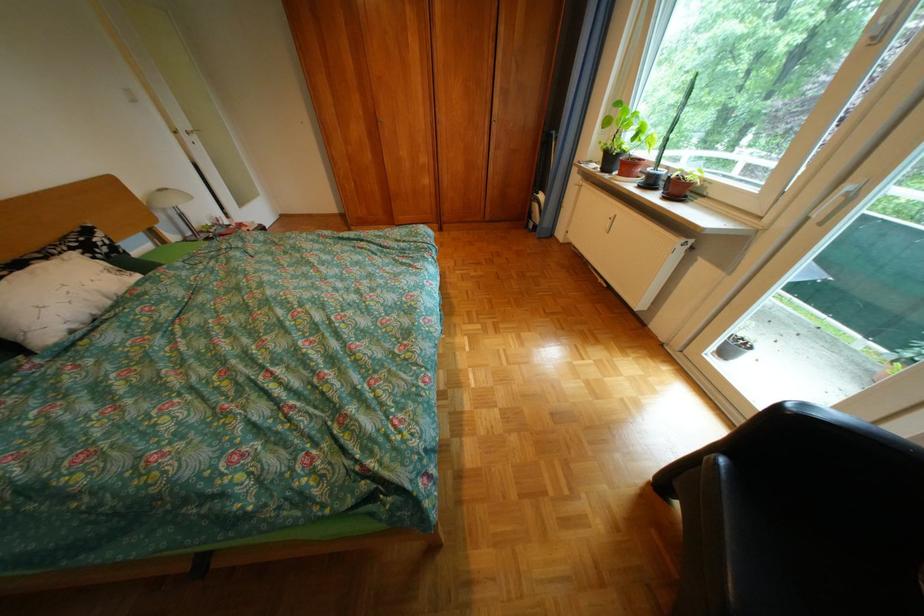
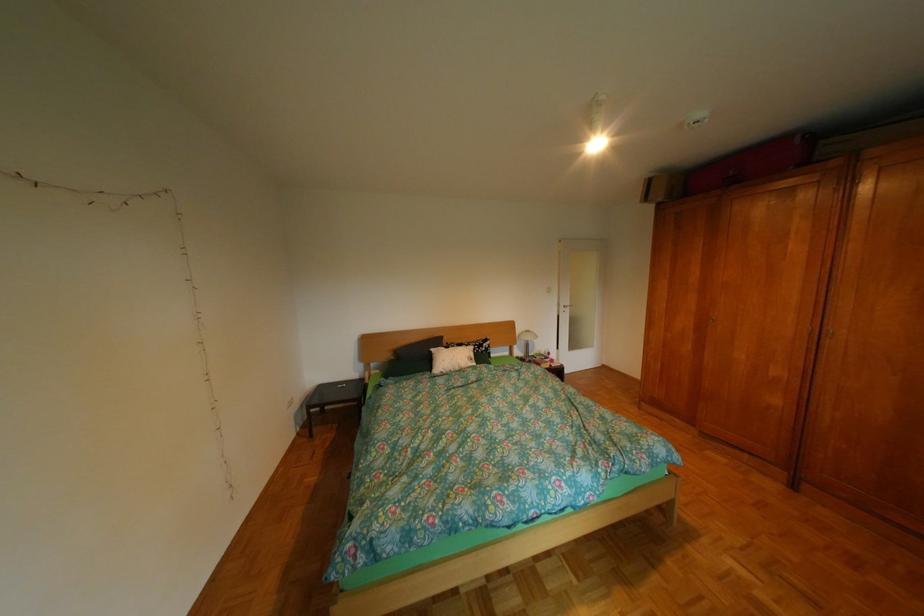
Question: The camera is either moving clockwise (left) or counter-clockwise (right) around the object. The first image is from the beginning of the video and the second image is from the end. Is the camera moving left or right when shooting the video?

Choices:
 (A) Left
 (B) Right

Answer: (B)